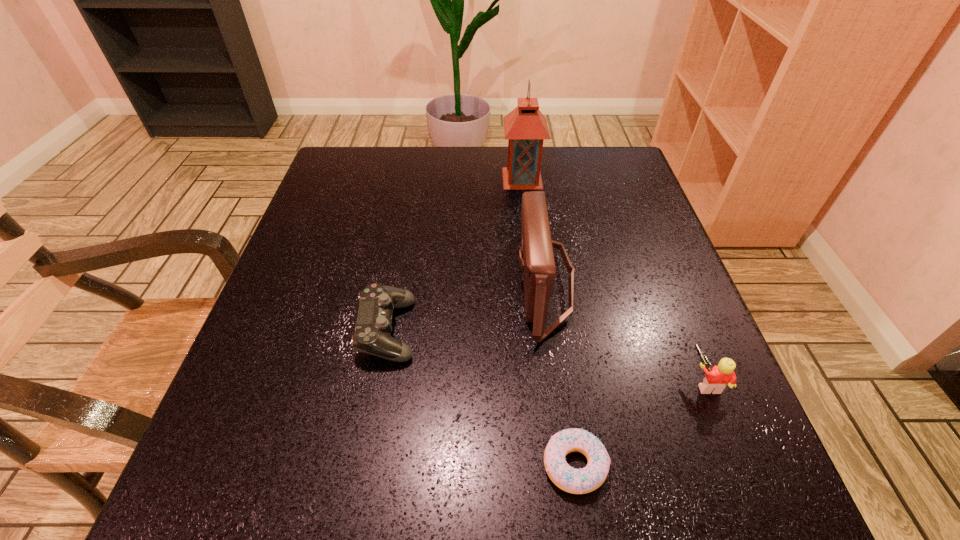
Locate an element on the screen. This screenshot has width=960, height=540. lantern is located at coordinates (525, 127).

Where is `the farthest object`? This screenshot has width=960, height=540. the farthest object is located at coordinates (525, 127).

This screenshot has height=540, width=960. I want to click on the fourth shortest object, so click(x=536, y=257).

You are a GUI agent. You are given a task and a screenshot of the screen. Output one action in this format:
    pyautogui.click(x=<x>, y=<y>)
    Task: Click on the rightmost object
    This screenshot has width=960, height=540.
    Given the screenshot: What is the action you would take?
    point(717,378)

The width and height of the screenshot is (960, 540). Identify the location of the third tallest object. (717, 378).

This screenshot has width=960, height=540. I want to click on control, so click(372, 335).

I want to click on the fourth tallest object, so click(x=372, y=335).

At what (x,y) coordinates should I click in order to perform the action: click on the nearest object. Please return your answer as a coordinate pair (x, y). The height and width of the screenshot is (540, 960). Looking at the image, I should click on (576, 481).

Identify the location of the shortest object. (576, 481).

Find the location of a particular element. vacant space situated on the front of the lantern is located at coordinates (534, 276).